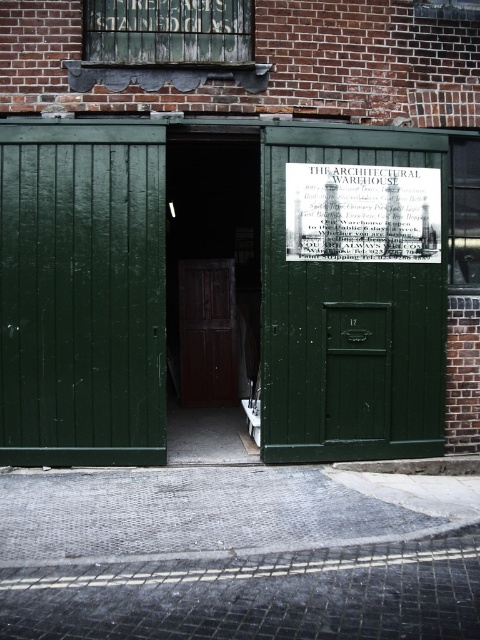
Question: Can you confirm if green wood door at center is bigger than dark wood door at center?

Choices:
 (A) no
 (B) yes

Answer: (B)

Question: Which of the following is the closest to the observer?

Choices:
 (A) white paper at upper center
 (B) green wood door at center

Answer: (A)

Question: Can you confirm if paved stone alley at center is positioned below wooden door at center?

Choices:
 (A) no
 (B) yes

Answer: (B)

Question: Which of the following is the farthest from the observer?

Choices:
 (A) green wooden door at center
 (B) paved stone alley at center

Answer: (A)

Question: Is green wooden door at center bigger than dark wood door at center?

Choices:
 (A) yes
 (B) no

Answer: (A)

Question: Which object is closer to the camera taking this photo?

Choices:
 (A) green wooden door at center
 (B) dark wood door at center
 (C) wooden door at center

Answer: (A)